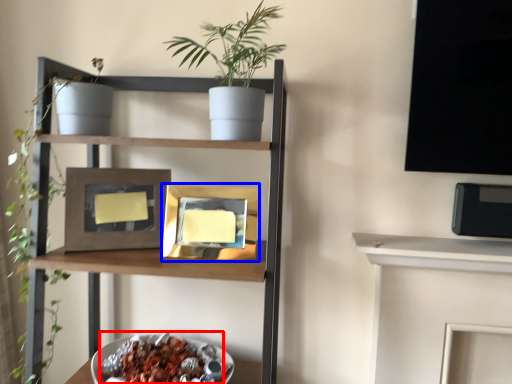
Question: Among these objects, which one is nearest to the camera, food (highlighted by a red box) or picture frame (highlighted by a blue box)?

Choices:
 (A) food
 (B) picture frame

Answer: (A)